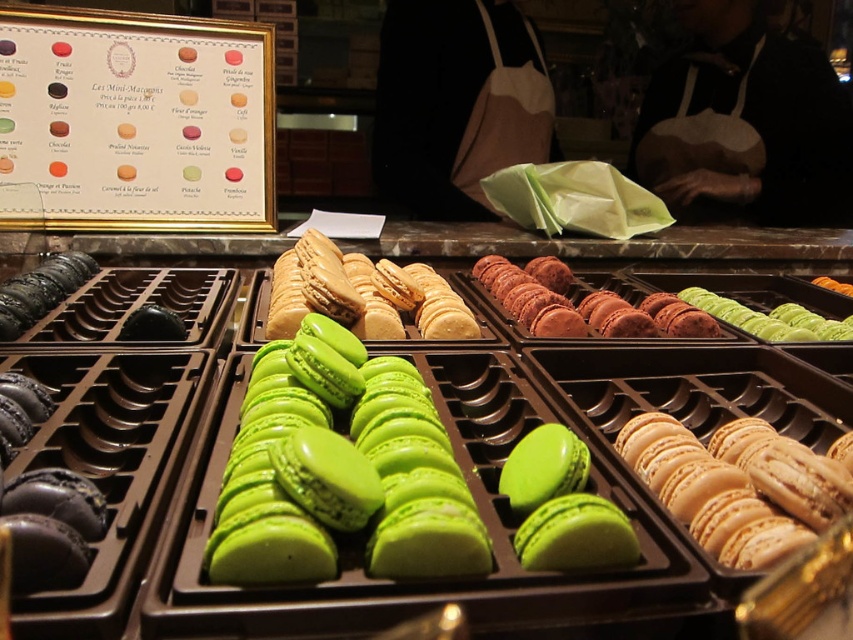
Question: From the image, what is the correct spatial relationship of green glossy macarons at center in relation to matte beige macarons at center right?

Choices:
 (A) left
 (B) right

Answer: (A)

Question: Can you confirm if green glossy macarons at center is positioned to the left of matte beige macarons at center right?

Choices:
 (A) no
 (B) yes

Answer: (B)

Question: Among these objects, which one is nearest to the camera?

Choices:
 (A) green glossy macarons at center
 (B) matte beige macarons at center right

Answer: (A)

Question: Which of the following is the farthest from the observer?

Choices:
 (A) (306, 397)
 (B) (735, 561)

Answer: (A)

Question: Is green glossy macarons at center to the right of matte beige macarons at center right from the viewer's perspective?

Choices:
 (A) no
 (B) yes

Answer: (A)

Question: Among these points, which one is nearest to the camera?

Choices:
 (A) (747, 541)
 (B) (428, 474)

Answer: (A)